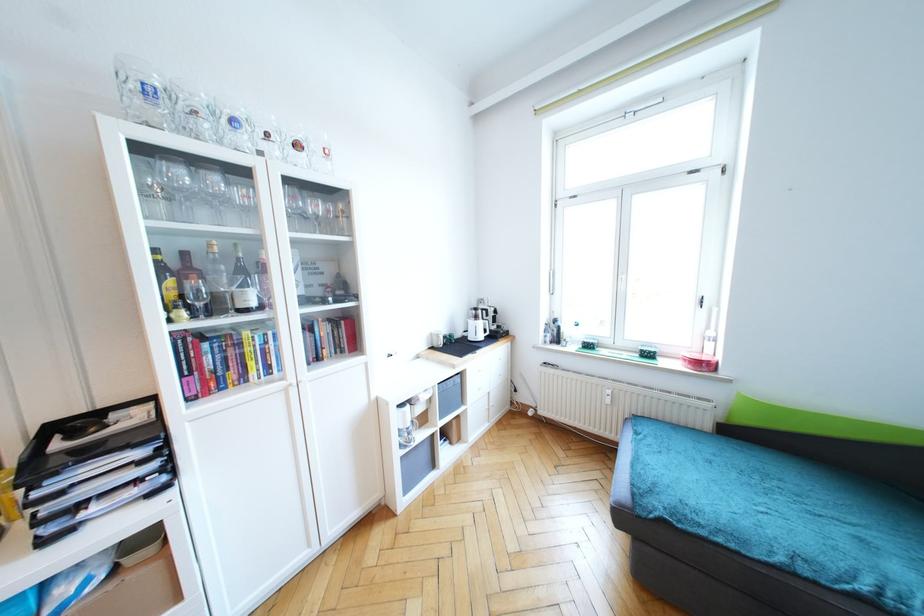
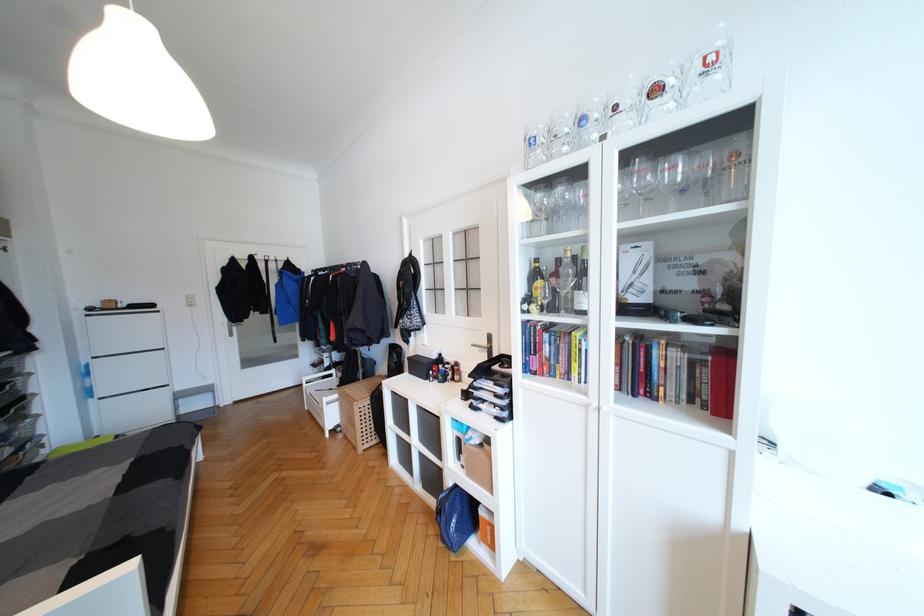
Question: The first image is from the beginning of the video and the second image is from the end. How did the camera likely rotate when shooting the video?

Choices:
 (A) Left
 (B) Right
 (C) Up
 (D) Down

Answer: (A)